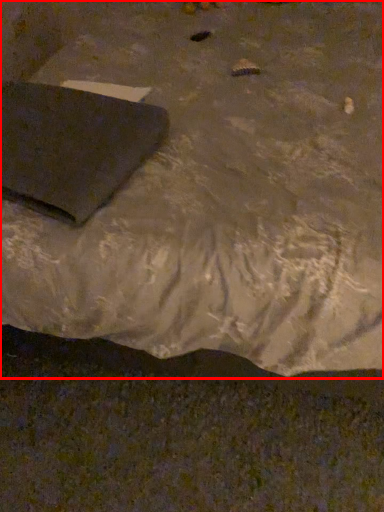
Question: From the image's perspective, considering the relative positions of furniture (annotated by the red box) and pad in the image provided, where is furniture (annotated by the red box) located with respect to the staircase?

Choices:
 (A) above
 (B) below

Answer: (A)